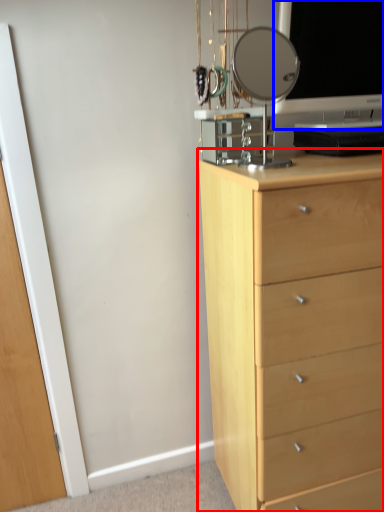
Question: Which object is further to the camera taking this photo, chest of drawers (highlighted by a red box) or computer monitor (highlighted by a blue box)?

Choices:
 (A) chest of drawers
 (B) computer monitor

Answer: (B)